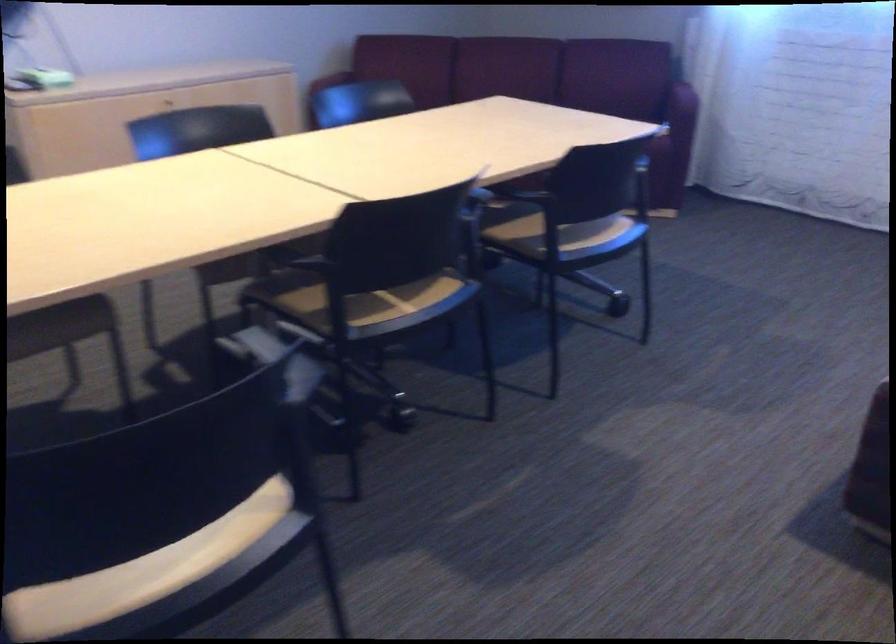
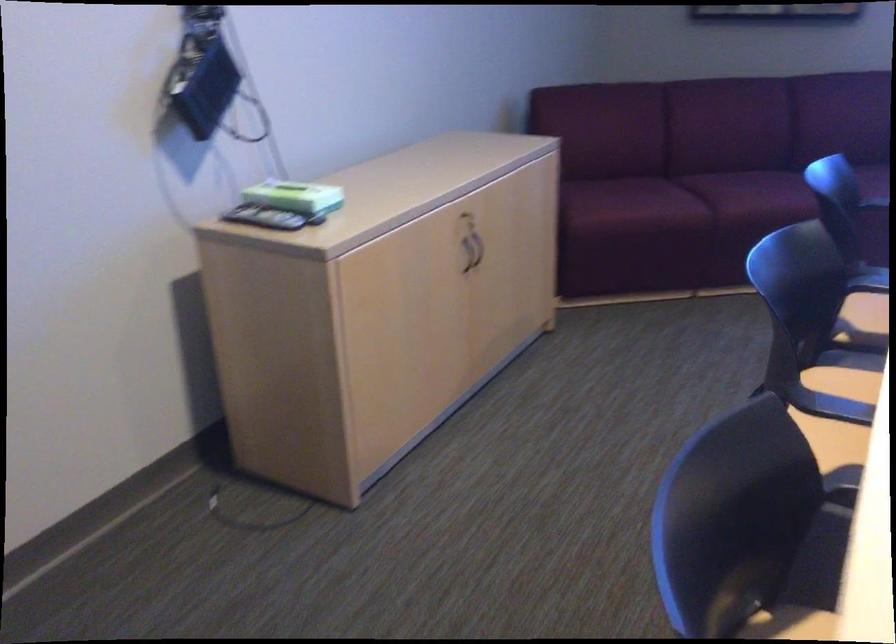
What movement of the cameraman would produce the second image?

The cameraman moved toward left, forward.